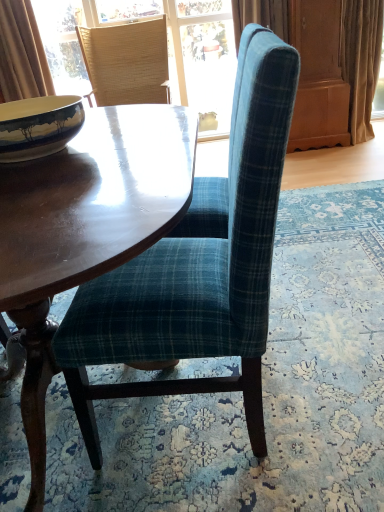
Identify the location of spots to the right of matte ceramic bowl at left. The image size is (384, 512). (140, 140).